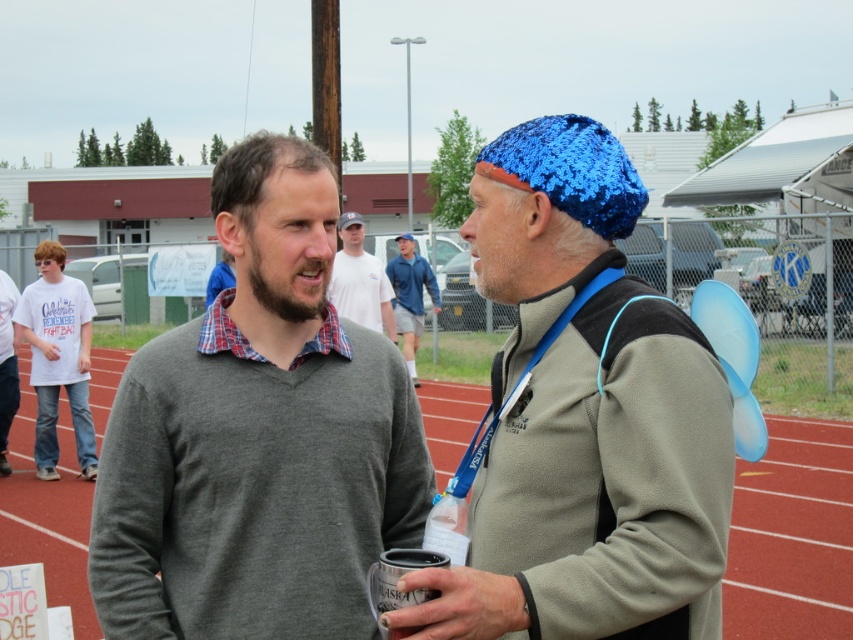
Between matte gray sweater at center and red rubber track at center, which one is positioned higher?

matte gray sweater at center is above.

Consider the image. Between matte gray sweater at center and red rubber track at center, which one appears on the right side from the viewer's perspective?

red rubber track at center

Does point (358, 464) lie behind point (39, 545)?

No.

Locate an element on the screen. The height and width of the screenshot is (640, 853). matte gray sweater at center is located at coordinates (258, 436).

Is matte gray sweater at center below blue knitted hat at center?

Yes, matte gray sweater at center is below blue knitted hat at center.

Is point (309, 196) positioned before point (419, 289)?

Yes, it is.

Identify the location of matte gray sweater at center. pos(258,436).

Does blue sequined beanie at center have a smaller size compared to translucent plastic cup at center?

Actually, blue sequined beanie at center might be larger than translucent plastic cup at center.

Find the location of `blue sequined beanie at center`. blue sequined beanie at center is located at coordinates (598, 490).